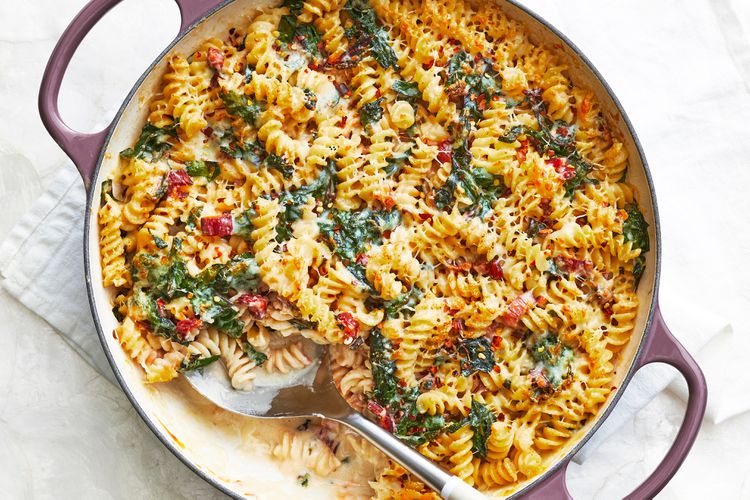
Where is `table`? table is located at coordinates (128, 462).